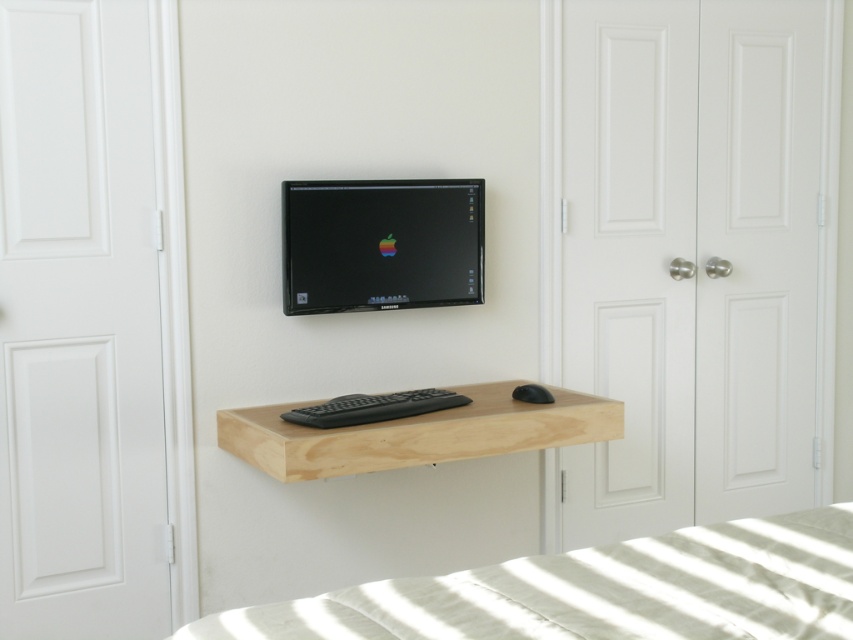
Question: Does natural wood floating shelf at center appear under black matte keyboard at center?

Choices:
 (A) yes
 (B) no

Answer: (A)

Question: Which object appears closest to the camera in this image?

Choices:
 (A) black matte mouse at center
 (B) black matte keyboard at center
 (C) white linen bed at lower center
 (D) natural wood floating shelf at center

Answer: (C)

Question: Is white linen bed at lower center thinner than black matte keyboard at center?

Choices:
 (A) yes
 (B) no

Answer: (B)

Question: Estimate the real-world distances between objects in this image. Which object is farther from the black matte mouse at center?

Choices:
 (A) black matte keyboard at center
 (B) natural wood floating shelf at center
 (C) white linen bed at lower center

Answer: (C)

Question: Can you confirm if black matte keyboard at center is positioned to the left of black matte mouse at center?

Choices:
 (A) no
 (B) yes

Answer: (B)

Question: Among these objects, which one is nearest to the camera?

Choices:
 (A) black matte keyboard at center
 (B) white linen bed at lower center

Answer: (B)